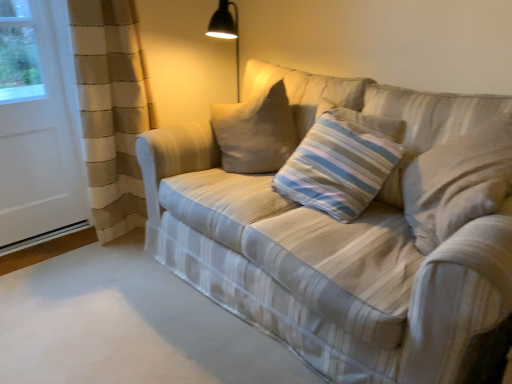
This screenshot has width=512, height=384. Identify the location of free spot to the right of white matte screen door at left. (95, 256).